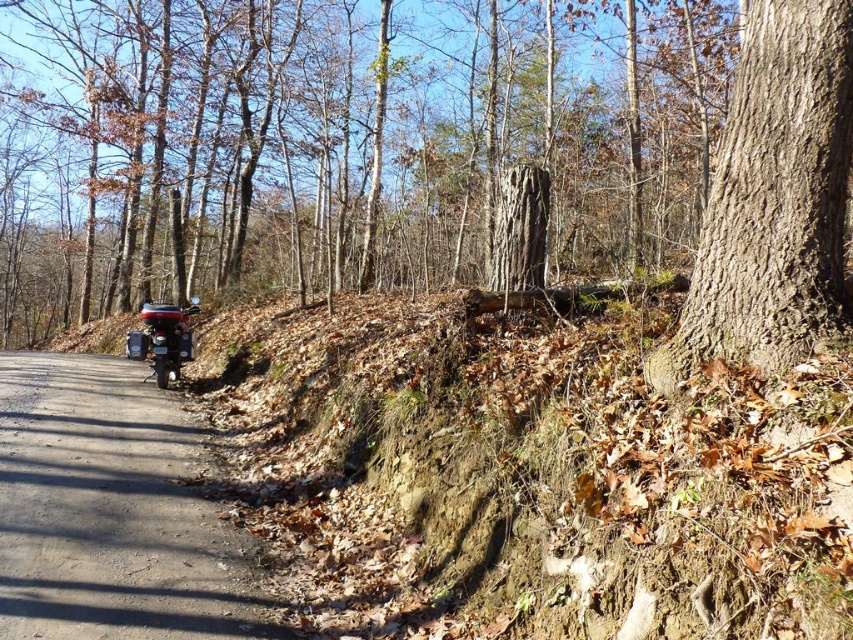
Between brown rough tree trunk at center right and black asphalt road at center, which one appears on the left side from the viewer's perspective?

Positioned to the left is brown rough tree trunk at center right.

The image size is (853, 640). Describe the element at coordinates (431, 157) in the screenshot. I see `brown rough tree trunk at center right` at that location.

Locate an element on the screen. This screenshot has height=640, width=853. brown rough tree trunk at center right is located at coordinates (431, 157).

Can you confirm if brown rough bark tree at right is taller than shiny metallic motorbike at lower left?

Yes, brown rough bark tree at right is taller than shiny metallic motorbike at lower left.

Does brown rough bark tree at right come behind shiny metallic motorbike at lower left?

No, brown rough bark tree at right is closer to the viewer.

Describe the element at coordinates (773, 198) in the screenshot. I see `brown rough bark tree at right` at that location.

Identify the location of brown rough bark tree at right. (773, 198).

Describe the element at coordinates (431, 157) in the screenshot. I see `brown rough tree trunk at center right` at that location.

Which is behind, point (289, 189) or point (811, 147)?

The point (289, 189) is more distant.

This screenshot has height=640, width=853. I want to click on brown rough tree trunk at center right, so click(x=431, y=157).